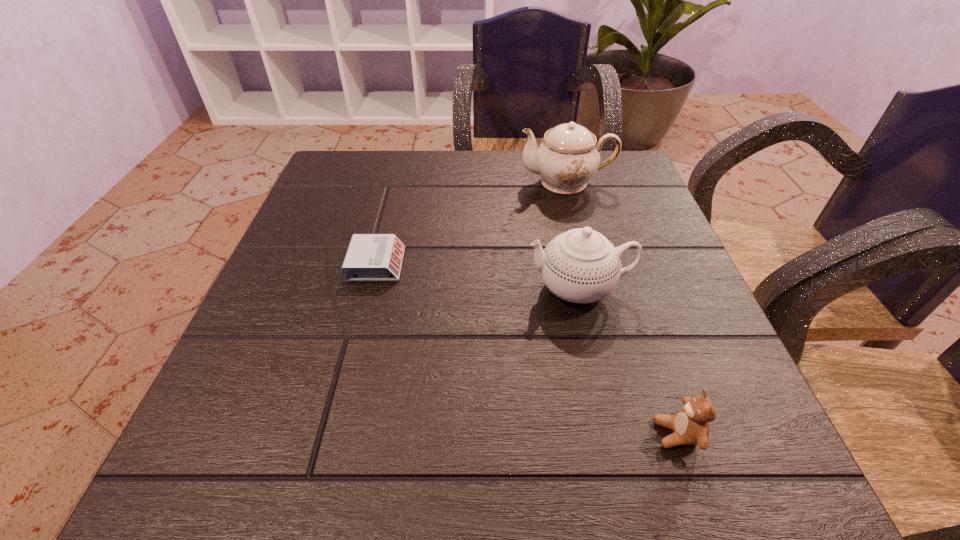
Where is `free space between the nearest object and the alarm clock`? free space between the nearest object and the alarm clock is located at coordinates (527, 349).

Find the location of `free space that is in between the nearer chinaware and the teddy bear`. free space that is in between the nearer chinaware and the teddy bear is located at coordinates (628, 361).

Locate an element on the screen. Image resolution: width=960 pixels, height=540 pixels. unoccupied position between the shortest object and the nearer chinaware is located at coordinates (478, 276).

I want to click on free spot between the nearest object and the nearer chinaware, so click(x=628, y=361).

Locate an element on the screen. The image size is (960, 540). vacant region between the shortest object and the nearest object is located at coordinates (527, 349).

Find the location of a particular element. The image size is (960, 540). free space between the alarm clock and the farther chinaware is located at coordinates (471, 223).

Where is `free point between the alarm clock and the farther chinaware`? free point between the alarm clock and the farther chinaware is located at coordinates (471, 223).

This screenshot has width=960, height=540. I want to click on the third closest object to the farther chinaware, so click(x=690, y=425).

Find the location of a particular element. object that is the third closest to the nearer chinaware is located at coordinates (370, 257).